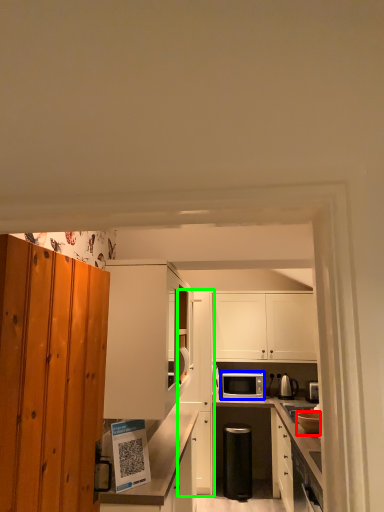
Question: Which is nearer to the appliance (highlighted by a red box)? microwave oven (highlighted by a blue box) or cabinetry (highlighted by a green box).

Choices:
 (A) microwave oven
 (B) cabinetry

Answer: (A)